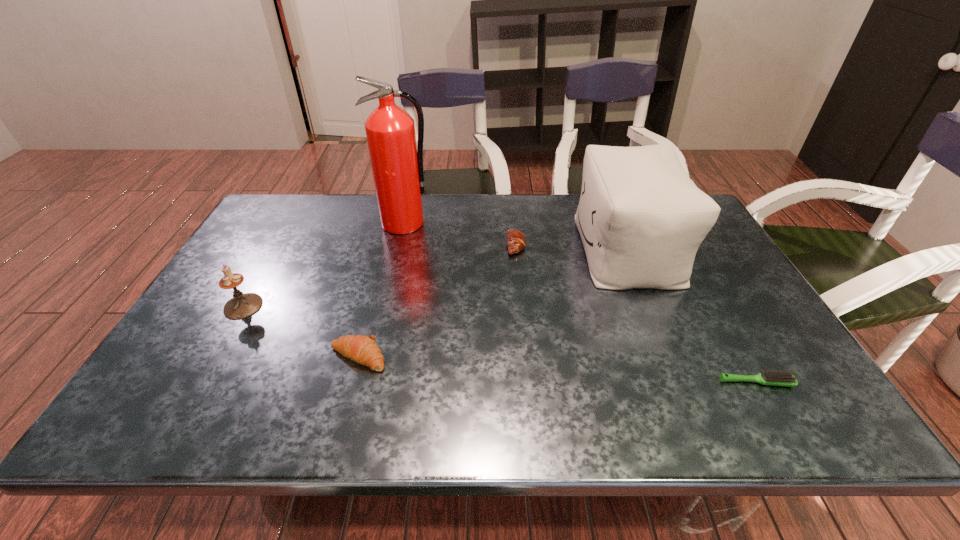
Find the location of a particular element. fire extinguisher is located at coordinates (397, 162).

The height and width of the screenshot is (540, 960). I want to click on cushion, so click(x=641, y=219).

Where is `the fourth farthest object`? Image resolution: width=960 pixels, height=540 pixels. the fourth farthest object is located at coordinates (241, 305).

Find the location of `candle holder`. candle holder is located at coordinates (241, 305).

Locate an element on the screen. the fifth farthest object is located at coordinates click(x=361, y=349).

Identify the location of the left crescent roll. Image resolution: width=960 pixels, height=540 pixels. (361, 349).

This screenshot has height=540, width=960. I want to click on the third object from right to left, so click(516, 241).

I want to click on the farther crescent roll, so (x=516, y=241).

Locate an element on the screen. The width and height of the screenshot is (960, 540). the shortest object is located at coordinates (777, 378).

At what (x,y) coordinates should I click in order to perform the action: click on the nearest object. Please return your answer as a coordinate pair (x, y). Looking at the image, I should click on (777, 378).